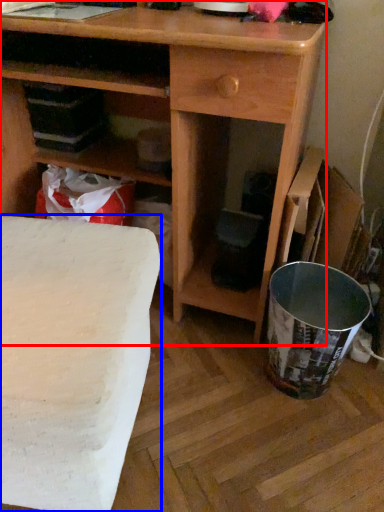
Question: Among these objects, which one is nearest to the camera, desk (highlighted by a red box) or table (highlighted by a blue box)?

Choices:
 (A) desk
 (B) table

Answer: (B)